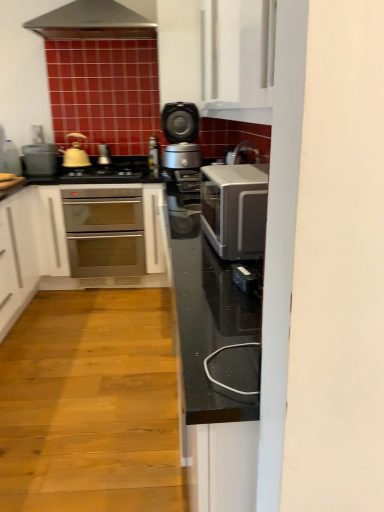
Question: Is matte silver toaster at left, which is the first appliance from left to right, inside the boundaries of satin silver toaster oven at center, or outside?

Choices:
 (A) outside
 (B) inside

Answer: (A)

Question: Is matte silver toaster at left, which appears as the 2th appliance when viewed from the right, taller or shorter than satin silver toaster oven at center?

Choices:
 (A) short
 (B) tall

Answer: (A)

Question: Based on their relative distances, which object is farther from the matte yellow tea pot at left?

Choices:
 (A) satin silver cooker at center
 (B) satin silver toaster oven at center
 (C) stainless steel oven at center
 (D) satin silver gas stove at center
 (E) matte silver toaster at left, which appears as the 2th appliance when viewed from the right

Answer: (B)

Question: Considering the real-world distances, which object is closest to the satin silver toaster oven at center?

Choices:
 (A) satin silver cooker at center
 (B) stainless steel oven at center
 (C) matte yellow tea pot at left
 (D) matte silver toaster at left, which appears as the 2th appliance when viewed from the right
 (E) satin silver gas stove at center

Answer: (A)